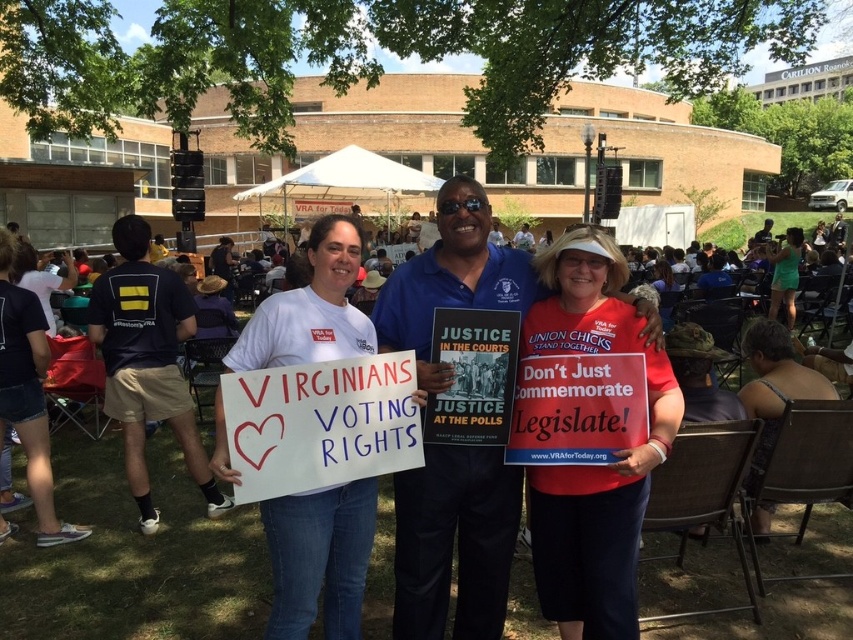
Does red matte sign at center lie behind white paper sign at center?

Yes, red matte sign at center is behind white paper sign at center.

Who is positioned more to the right, red matte sign at center or white paper sign at center?

Positioned to the right is red matte sign at center.

In order to click on red matte sign at center in this screenshot , I will do `click(593, 465)`.